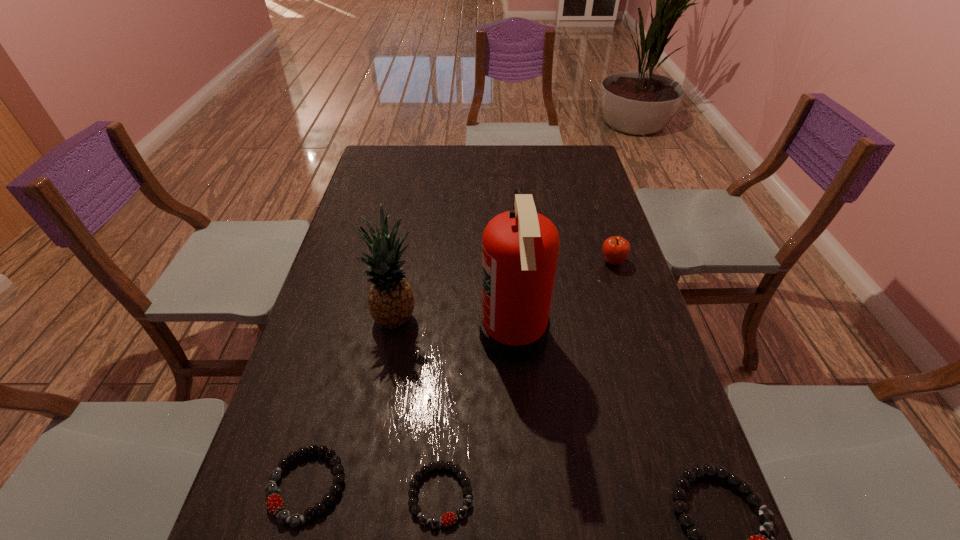
You are a GUI agent. You are given a task and a screenshot of the screen. Output one action in this format:
    pyautogui.click(x=<x>, y=<y>)
    Task: Click on the vacant area located 0.230m on the left of the second bracelet from left to right
    The image size is (960, 540).
    Given the screenshot: What is the action you would take?
    pyautogui.click(x=290, y=495)

Find the location of `free location located on the front of the pineapple`. free location located on the front of the pineapple is located at coordinates (383, 394).

Identify the location of vacant area situated on the front of the fourth shortest object. The image size is (960, 540). (633, 325).

Locate an element on the screen. vacant region located at the nozzle of the tallest object is located at coordinates (367, 335).

This screenshot has width=960, height=540. What are the coordinates of `free spot located 0.110m at the nozzle of the tallest object` in the screenshot? It's located at (x=437, y=335).

Locate an element on the screen. vacant space located at the nozzle of the tallest object is located at coordinates (378, 335).

Find the location of a particular element. bracelet that is at the left edge is located at coordinates (283, 516).

This screenshot has width=960, height=540. I want to click on pineapple positioned at the left edge, so click(391, 301).

Locate an element on the screen. This screenshot has height=540, width=960. object that is at the right edge is located at coordinates (615, 249).

In order to click on object positioned at the near left corner in this screenshot , I will do `click(283, 516)`.